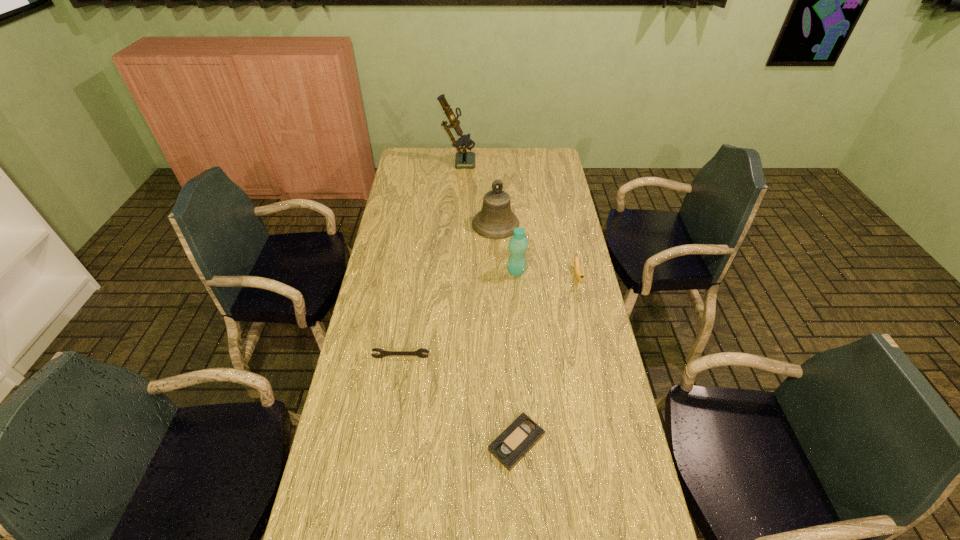
At what (x,y) coordinates should I click in order to perform the action: click on vacant space that's between the fifth tallest object and the second farthest object. Please return your answer as a coordinate pair (x, y). Image resolution: width=960 pixels, height=540 pixels. Looking at the image, I should click on (448, 291).

Find the location of `free point between the nearest object and the bottle`. free point between the nearest object and the bottle is located at coordinates (516, 357).

Image resolution: width=960 pixels, height=540 pixels. Identify the location of unoccupied area between the second shortest object and the bottle. (459, 314).

Identify which object is the fourth nearest to the fifth tallest object. Please provide its 2D coordinates. Your answer should be formatted as a tuple, i.e. [(x, y)], where the tuple contains the x and y coordinates of a point satisfying the conditions above.

[(579, 277)]

The height and width of the screenshot is (540, 960). Find the location of `object that stands as the second closest to the microscope`. object that stands as the second closest to the microscope is located at coordinates (518, 243).

This screenshot has height=540, width=960. I want to click on free location that satisfies the following two spatial constraints: 1. on the back side of the shortest object; 2. on the right side of the bottle, so click(x=506, y=272).

Find the location of a particular element. free location that satisfies the following two spatial constraints: 1. on the front side of the bottle; 2. on the left side of the bell is located at coordinates (497, 272).

Find the location of a particular element. free space that satisfies the following two spatial constraints: 1. on the open ends of the shortest object; 2. on the left side of the second nearest object is located at coordinates (388, 443).

Locate an element on the screen. blank area in the image that satisfies the following two spatial constraints: 1. at the eyepiece of the microscope; 2. on the right side of the bottle is located at coordinates (451, 272).

Identify the location of vacant region that satisfies the following two spatial constraints: 1. at the eyepiece of the second farthest object; 2. on the right side of the farthest object. The image size is (960, 540). [x=454, y=224].